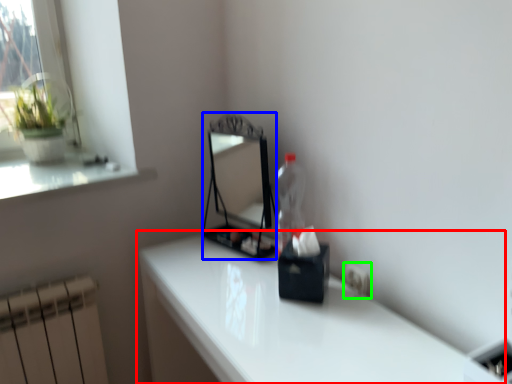
Question: Based on their relative distances, which object is nearer to table (highlighted by a red box)? Choose from mirror (highlighted by a blue box) and electric outlet (highlighted by a green box).

Choices:
 (A) mirror
 (B) electric outlet

Answer: (B)